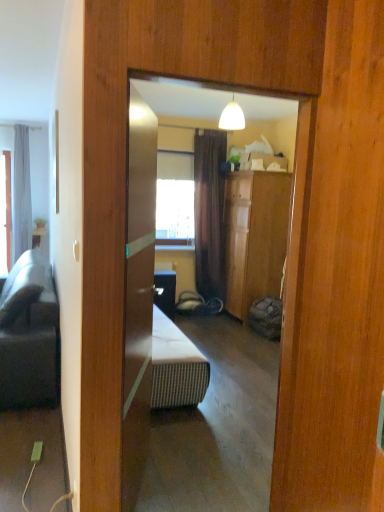
Question: From a real-world perspective, is matte white table at left physically above gray fabric curtain at left?

Choices:
 (A) no
 (B) yes

Answer: (A)

Question: Is matte white table at left next to gray fabric curtain at left and touching it?

Choices:
 (A) yes
 (B) no

Answer: (B)

Question: Does matte white table at left appear on the right side of gray fabric curtain at left?

Choices:
 (A) no
 (B) yes

Answer: (B)

Question: Is gray fabric curtain at left at the back of matte white table at left?

Choices:
 (A) yes
 (B) no

Answer: (B)

Question: Can you confirm if matte white table at left is smaller than gray fabric curtain at left?

Choices:
 (A) no
 (B) yes

Answer: (B)

Question: Is dark gray fabric studio couch at left taller or shorter than matte white table at left?

Choices:
 (A) tall
 (B) short

Answer: (A)

Question: From the image's perspective, is dark gray fabric studio couch at left above or below matte white table at left?

Choices:
 (A) above
 (B) below

Answer: (B)

Question: In the image, is dark gray fabric studio couch at left positioned in front of or behind matte white table at left?

Choices:
 (A) behind
 (B) front

Answer: (B)

Question: Would you say dark gray fabric studio couch at left is to the left or to the right of matte white table at left in the picture?

Choices:
 (A) left
 (B) right

Answer: (B)

Question: Do you think matte white table at left is within gray fabric curtain at left, or outside of it?

Choices:
 (A) inside
 (B) outside

Answer: (B)

Question: Is point (33, 236) positioned closer to the camera than point (26, 140)?

Choices:
 (A) farther
 (B) closer

Answer: (B)

Question: From the image's perspective, is matte white table at left above or below gray fabric curtain at left?

Choices:
 (A) above
 (B) below

Answer: (B)

Question: Considering the positions of matte white table at left and gray fabric curtain at left in the image, is matte white table at left taller or shorter than gray fabric curtain at left?

Choices:
 (A) tall
 (B) short

Answer: (B)

Question: Would you say gray fabric curtain at left is inside or outside matte white table at left?

Choices:
 (A) outside
 (B) inside

Answer: (A)

Question: Considering the positions of point (13, 234) and point (34, 244), is point (13, 234) closer or farther from the camera than point (34, 244)?

Choices:
 (A) farther
 (B) closer

Answer: (B)